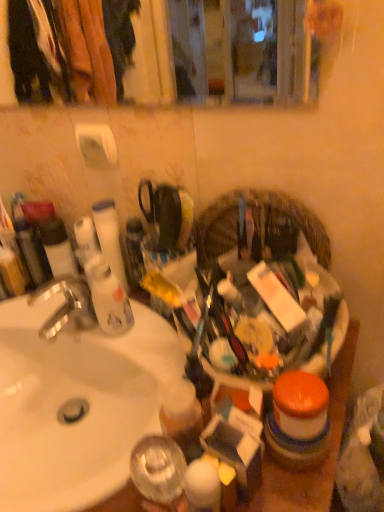
Question: From the image's perspective, relative to silver metallic faucet at left, is white glossy sink at left above or below?

Choices:
 (A) below
 (B) above

Answer: (A)

Question: Is point (122, 367) positioned closer to the camera than point (51, 315)?

Choices:
 (A) farther
 (B) closer

Answer: (B)

Question: Which of these objects is positioned closest to the silver metallic faucet at left?

Choices:
 (A) white matte toilet paper at upper left, the second toilet paper from the bottom
 (B) white glossy sink at left
 (C) white matte tube at left, the first toilet paper when ordered from bottom to top
 (D) plastic woven basket at center
 (E) matte black tube at left

Answer: (E)

Question: Which is nearer to the matte black tube at left?

Choices:
 (A) plastic woven basket at center
 (B) silver metallic faucet at left
 (C) white glossy sink at left
 (D) white matte tube at left, placed as the 2th toilet paper when sorted from top to bottom
 (E) white matte toilet paper at upper left, the 1th toilet paper in the top-to-bottom sequence

Answer: (B)